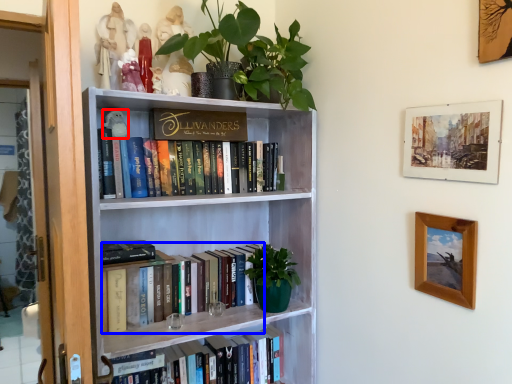
Question: Which point is further to the camera, toy (highlighted by a red box) or book (highlighted by a blue box)?

Choices:
 (A) toy
 (B) book

Answer: (A)